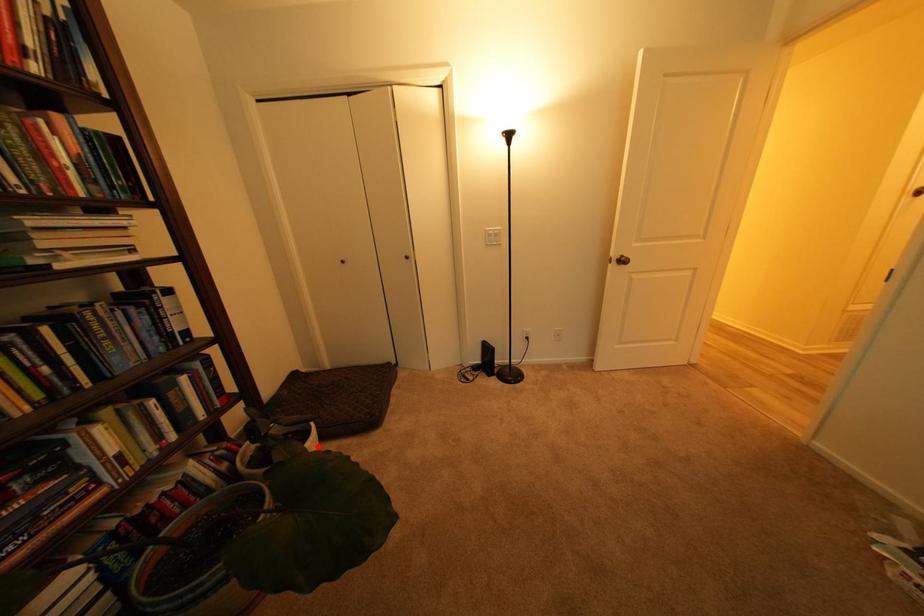
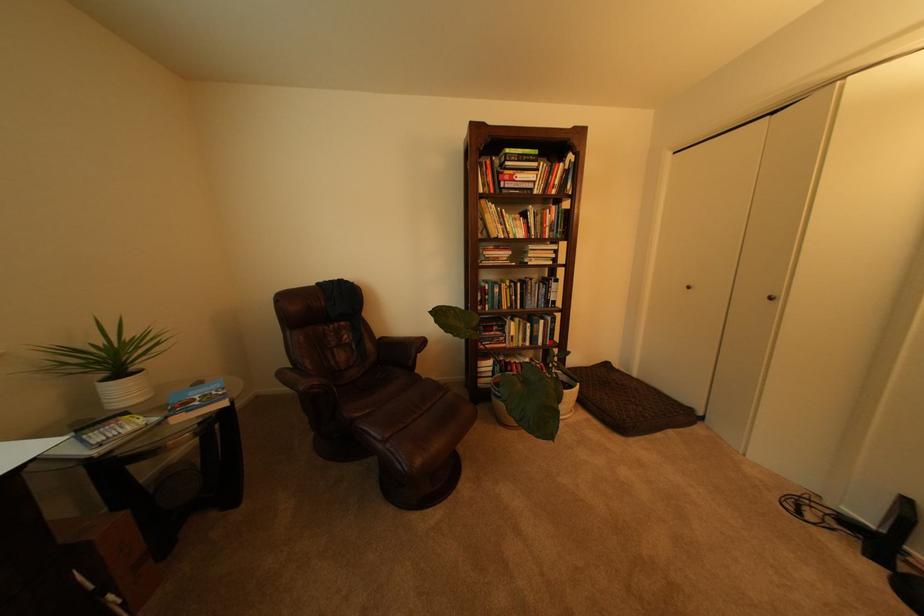
Find the pixel in the second image that matches the highlighted location in the first image.

(576, 392)